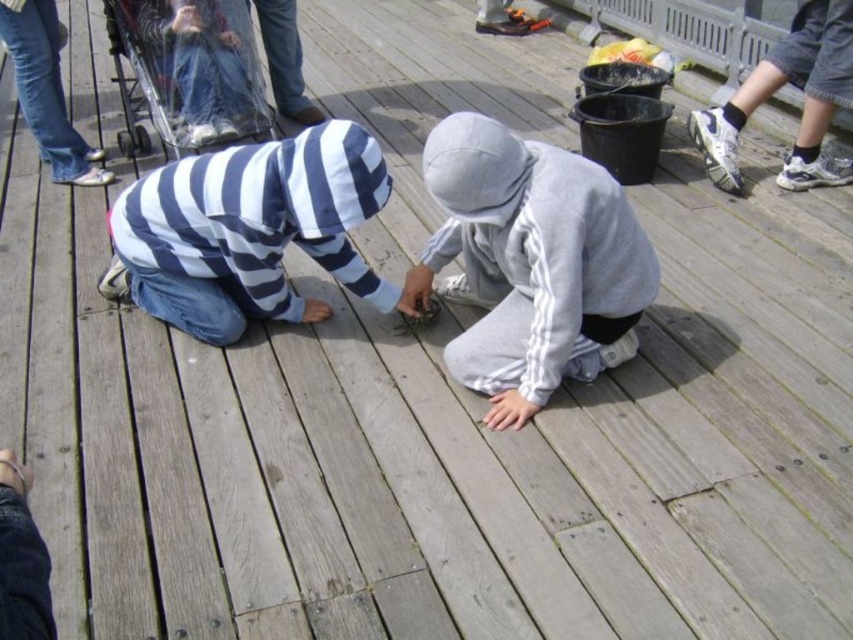
You are standing on the wooden deck and want to hand a crab to the person in the striped hoodie at center. Which direction should you move to ensure you can reach them without obstructing the view of the gray fleece hoodie at center?

Since the gray fleece hoodie at center is in front of the striped hoodie at center, you should move behind the gray fleece hoodie at center to hand the crab to the striped hoodie at center without blocking their view.

You are a photographer trying to capture a candid shot of the two people on the wooden deck. You want to ensure that both the gray fleece hoodie at center and the striped hoodie at center are clearly visible in the frame. Based on their positions, which person should you focus on first to ensure both are in the shot?

The gray fleece hoodie at center is positioned on the right side of striped hoodie at center, so you should focus on the striped hoodie at center first to ensure both are in the frame.